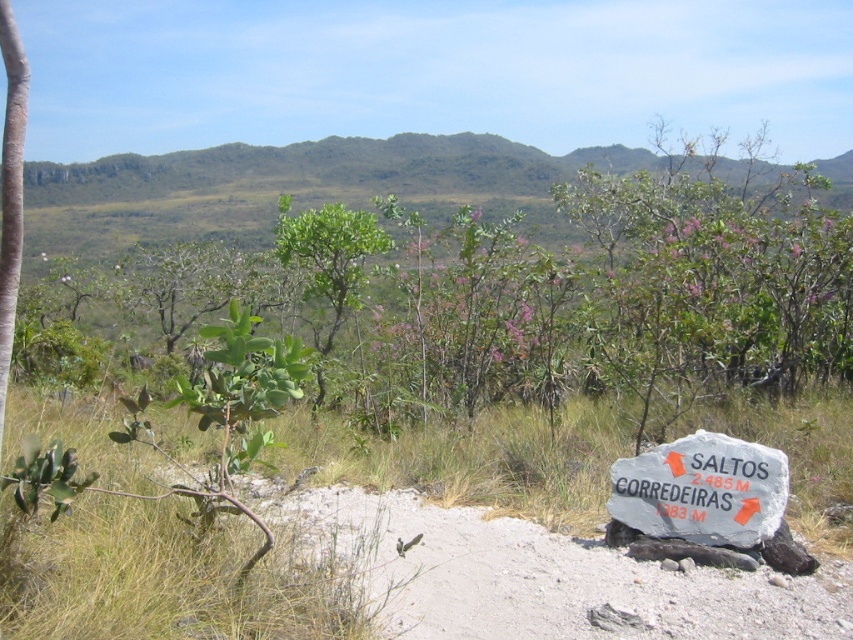
Question: From the image, what is the correct spatial relationship of green leafy tree at center in relation to gray stone sign at lower right?

Choices:
 (A) right
 (B) left

Answer: (B)

Question: Can you confirm if green leafy tree at center is positioned to the right of gray stone sign at lower right?

Choices:
 (A) no
 (B) yes

Answer: (A)

Question: Which point appears closest to the camera in this image?

Choices:
 (A) (694, 442)
 (B) (103, 161)

Answer: (A)

Question: Is green leafy tree at center in front of gray stone sign at lower right?

Choices:
 (A) yes
 (B) no

Answer: (B)

Question: Which object is farther from the camera taking this photo?

Choices:
 (A) green leafy tree at center
 (B) gray stone sign at lower right

Answer: (A)

Question: Among these objects, which one is nearest to the camera?

Choices:
 (A) gray stone sign at lower right
 (B) green leafy tree at center

Answer: (A)